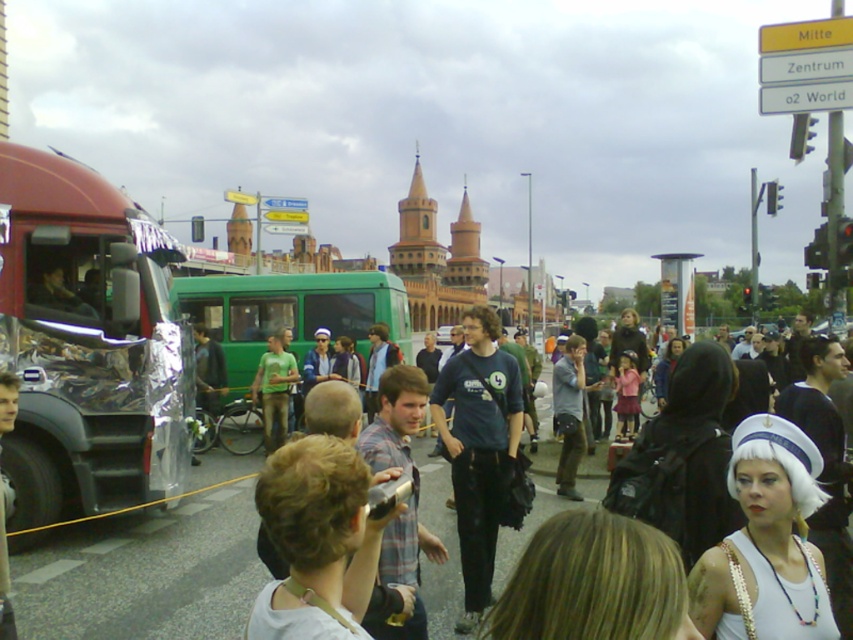
You are a photographer who wants to take a photo of the crowd without any obstructions. You have a matte black backpack at center and a matte black camera at lower left in your view. Which object should you move to avoid blocking your shot?

You should move the matte black backpack at center because it is positioned over the matte black camera at lower left, which is likely blocking the camera lens.

You are a photographer at the event and want to take a photo of the light brown hair at center. Where should you aim your camera?

You should aim your camera at point (318,540) to capture the light brown hair at center.

You are a photographer at the event and want to take a photo of both the light brown hair at center and the matte black camera at lower left. Which object should you focus on first to ensure both are in frame?

The light brown hair at center is positioned on the right side of the matte black camera at lower left, so you should focus on the matte black camera at lower left first to ensure both are in frame.